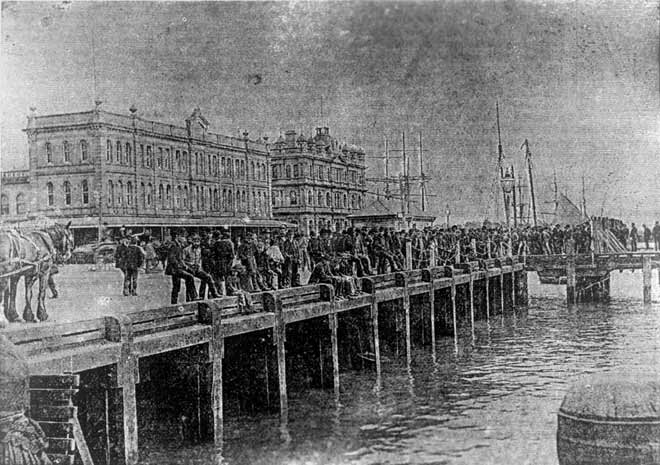
The width and height of the screenshot is (660, 465). What are the coordinates of `window` in the screenshot? It's located at (47, 153).